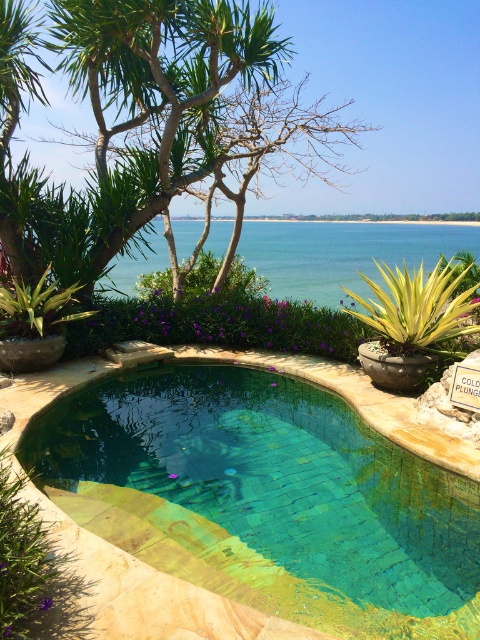
Is teal mosaic pool at center thinner than green leafy tree at upper left?

Yes, teal mosaic pool at center is thinner than green leafy tree at upper left.

Is teal mosaic pool at center shorter than green leafy tree at upper left?

Indeed, teal mosaic pool at center has a lesser height compared to green leafy tree at upper left.

Does point (442, 602) come closer to viewer compared to point (68, 65)?

Yes, it is in front of point (68, 65).

Find the location of a particular element. Image resolution: width=480 pixels, height=640 pixels. teal mosaic pool at center is located at coordinates (265, 499).

This screenshot has width=480, height=640. What are the coordinates of `teal mosaic pool at center` in the screenshot? It's located at (265, 499).

Can you confirm if teal mosaic pool at center is positioned below clear blue water at center?

Correct, teal mosaic pool at center is located below clear blue water at center.

Which is behind, point (95, 420) or point (307, 284)?

Positioned behind is point (307, 284).

Find the location of a particular element. teal mosaic pool at center is located at coordinates (265, 499).

Is green leafy tree at upper left in front of clear blue water at center?

Yes, it is.

Who is shorter, green leafy tree at upper left or clear blue water at center?

With less height is clear blue water at center.

This screenshot has height=640, width=480. What do you see at coordinates (146, 122) in the screenshot? I see `green leafy tree at upper left` at bounding box center [146, 122].

This screenshot has height=640, width=480. Identify the location of green leafy tree at upper left. (146, 122).